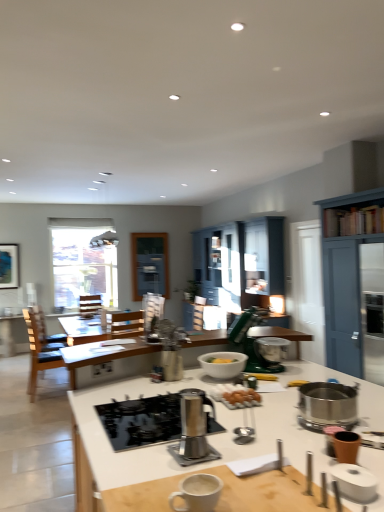
Question: Considering the relative sizes of clear glass window at upper left and blue painted wood cabinet at right, which is counted as the 2th cabinetry, starting from the back, in the image provided, is clear glass window at upper left taller than blue painted wood cabinet at right, which is counted as the 2th cabinetry, starting from the back,?

Choices:
 (A) no
 (B) yes

Answer: (A)

Question: Is clear glass window at upper left to the right of blue painted wood cabinet at right, acting as the first cabinetry starting from the right, from the viewer's perspective?

Choices:
 (A) yes
 (B) no

Answer: (B)

Question: Considering the relative sizes of clear glass window at upper left and blue painted wood cabinet at right, the second cabinetry from the left, in the image provided, is clear glass window at upper left shorter than blue painted wood cabinet at right, the second cabinetry from the left,?

Choices:
 (A) yes
 (B) no

Answer: (A)

Question: From the image's perspective, is clear glass window at upper left located beneath blue painted wood cabinet at right, acting as the first cabinetry starting from the right?

Choices:
 (A) no
 (B) yes

Answer: (A)

Question: Can you confirm if clear glass window at upper left is positioned to the left of blue painted wood cabinet at right, acting as the first cabinetry starting from the right?

Choices:
 (A) yes
 (B) no

Answer: (A)

Question: Visually, is metallic silver stand mixer at center, the second appliance viewed from the back, positioned to the left or to the right of brown matte cup at lower right, marked as the second appliance in a front-to-back arrangement?

Choices:
 (A) right
 (B) left

Answer: (B)

Question: Would you say metallic silver stand mixer at center, which appears as the 4th appliance when viewed from the front, is inside or outside brown matte cup at lower right, marked as the second appliance in a front-to-back arrangement?

Choices:
 (A) outside
 (B) inside

Answer: (A)

Question: Considering the positions of point (167, 327) and point (349, 436), is point (167, 327) closer or farther from the camera than point (349, 436)?

Choices:
 (A) farther
 (B) closer

Answer: (A)

Question: In terms of width, does metallic silver stand mixer at center, the second appliance viewed from the back, look wider or thinner when compared to brown matte cup at lower right, which ranks as the fourth appliance in back-to-front order?

Choices:
 (A) wide
 (B) thin

Answer: (A)

Question: Based on their sizes in the image, would you say white ceramic mug at lower center is bigger or smaller than satin silver coffee maker at center, the 3th appliance viewed from the front?

Choices:
 (A) small
 (B) big

Answer: (A)

Question: Is point (203, 475) positioned closer to the camera than point (210, 404)?

Choices:
 (A) farther
 (B) closer

Answer: (B)

Question: Considering the positions of white ceramic mug at lower center and satin silver coffee maker at center, the 3th appliance viewed from the front, in the image, is white ceramic mug at lower center wider or thinner than satin silver coffee maker at center, the 3th appliance viewed from the front,?

Choices:
 (A) thin
 (B) wide

Answer: (B)

Question: Is white ceramic mug at lower center to the left or to the right of satin silver coffee maker at center, which ranks as the 3th appliance in back-to-front order, in the image?

Choices:
 (A) right
 (B) left

Answer: (A)

Question: From a real-world perspective, is brown wooden chair at left physically located above or below stainless steel gas stove at center?

Choices:
 (A) below
 (B) above

Answer: (A)

Question: Is point (46, 366) positioned closer to the camera than point (170, 432)?

Choices:
 (A) closer
 (B) farther

Answer: (B)